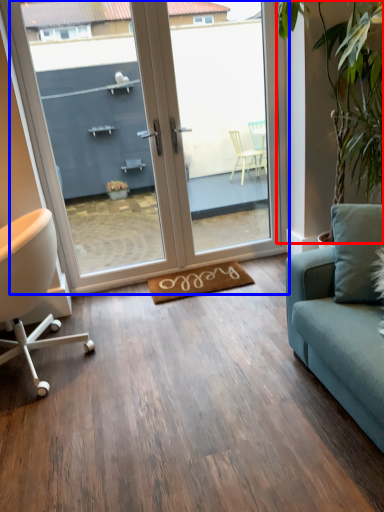
Question: Which object appears farthest to the camera in this image, plant (highlighted by a red box) or door (highlighted by a blue box)?

Choices:
 (A) plant
 (B) door

Answer: (B)